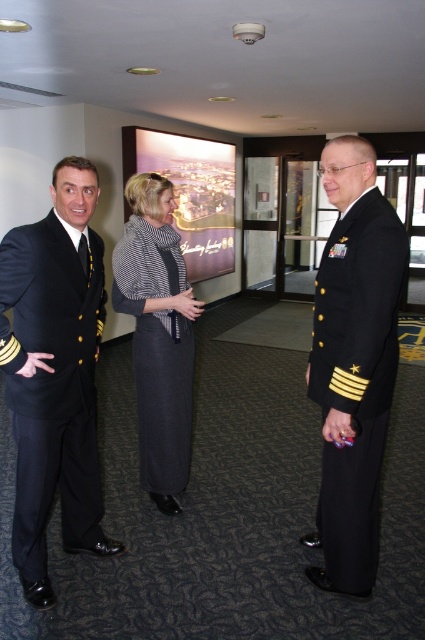
Question: Which point is farther from the camera taking this photo?

Choices:
 (A) (102, 324)
 (B) (144, 403)
 (C) (161, 180)

Answer: (B)

Question: From the image, what is the correct spatial relationship of shiny black suit at left in relation to shiny black uniform at center?

Choices:
 (A) right
 (B) left

Answer: (B)

Question: Does black wool suit at center have a smaller size compared to striped wool scarf at center?

Choices:
 (A) yes
 (B) no

Answer: (B)

Question: Does black wool suit at center appear under striped wool scarf at center?

Choices:
 (A) yes
 (B) no

Answer: (A)

Question: Which of the following is the farthest from the observer?

Choices:
 (A) shiny black suit at left
 (B) striped wool scarf at center

Answer: (B)

Question: Which of the following is the closest to the observer?

Choices:
 (A) striped wool scarf at center
 (B) black wool suit at center

Answer: (B)